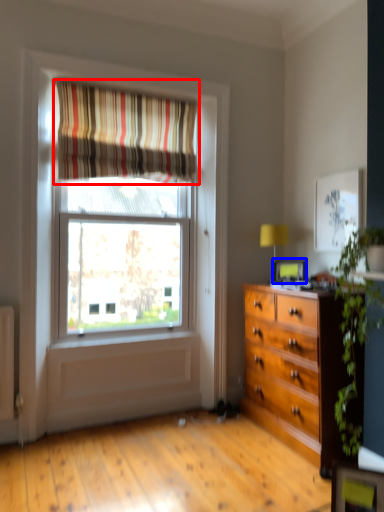
Question: Which of the following is the closest to the observer, curtain (highlighted by a red box) or picture frame (highlighted by a blue box)?

Choices:
 (A) curtain
 (B) picture frame

Answer: (A)